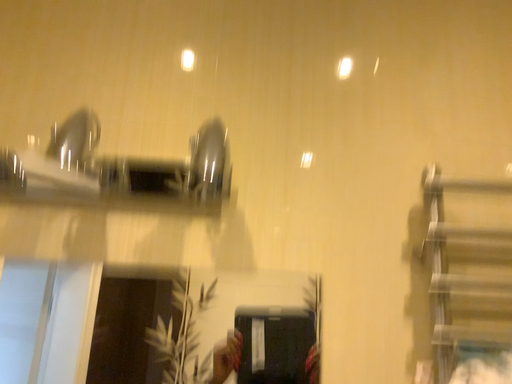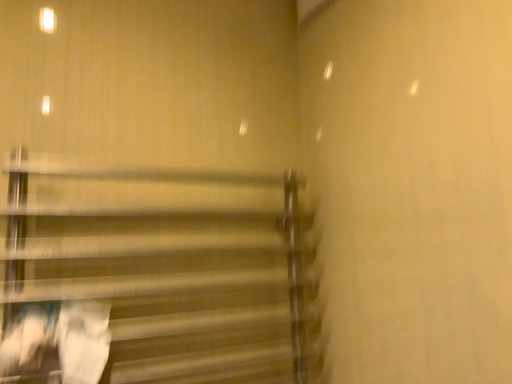
Question: Which way did the camera rotate in the video?

Choices:
 (A) rotated right
 (B) rotated left

Answer: (A)